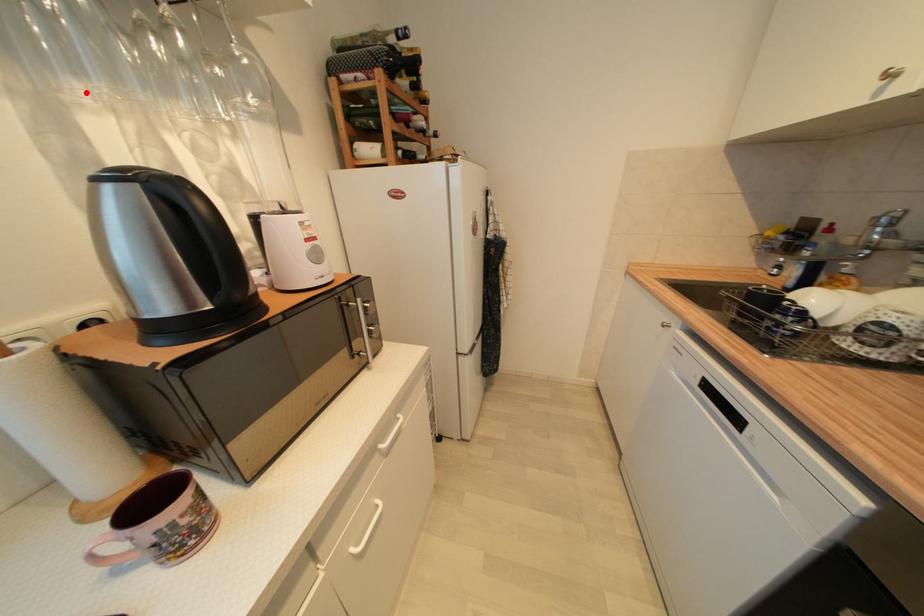
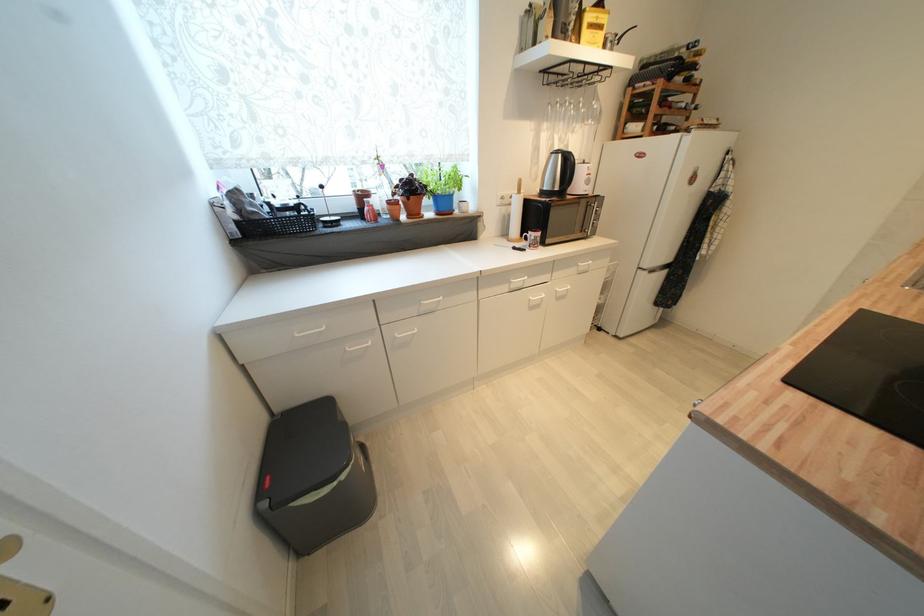
Question: A red point is marked in image1. In image2, is the corresponding 3D point closer to the camera or farther? Reply with the corresponding letter.

Choices:
 (A) The corresponding 3D point is closer.
 (B) The corresponding 3D point is farther.

Answer: (A)